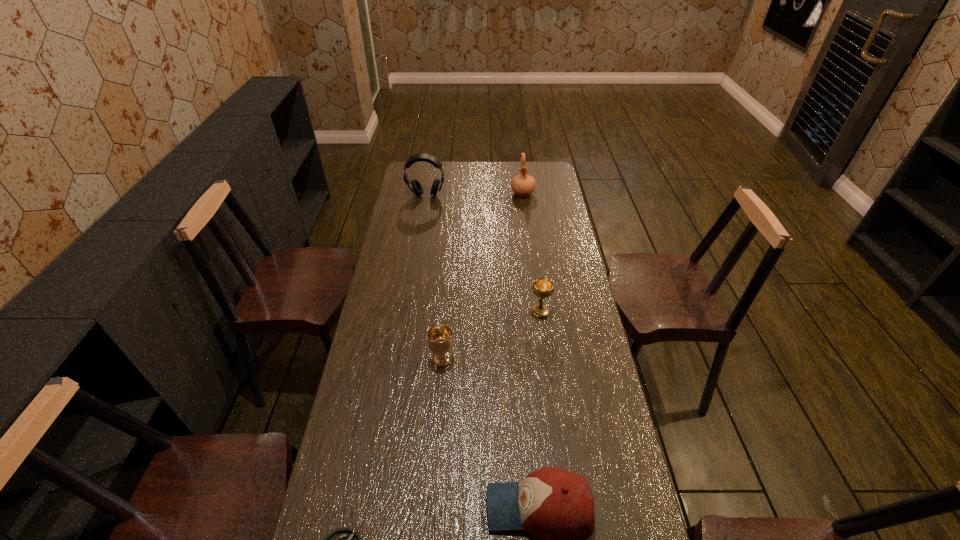
At what (x,y) coordinates should I click in order to perform the action: click on earphone. Please return your answer as a coordinate pair (x, y). This screenshot has height=540, width=960. Looking at the image, I should click on (414, 185).

This screenshot has height=540, width=960. In order to click on pottery in this screenshot , I will do point(523,185).

I want to click on the third farthest object, so click(x=542, y=287).

This screenshot has height=540, width=960. In order to click on the right chalice in this screenshot , I will do `click(542, 287)`.

Locate an element on the screen. the fourth object from right to left is located at coordinates (440, 340).

Find the location of a particular element. The height and width of the screenshot is (540, 960). the nearer chalice is located at coordinates (440, 340).

At what (x,y) coordinates should I click in order to perform the action: click on vacant space located on the ear cups of the earphone. Please return your answer as a coordinate pair (x, y). The width and height of the screenshot is (960, 540). Looking at the image, I should click on (420, 228).

At what (x,y) coordinates should I click in order to perform the action: click on vacant region located on the spout of the pottery. Please return your answer as a coordinate pair (x, y). The height and width of the screenshot is (540, 960). Looking at the image, I should click on (526, 216).

The width and height of the screenshot is (960, 540). I want to click on free space located on the right of the third farthest object, so click(x=582, y=312).

Find the location of a particular element. This screenshot has width=960, height=540. vacant space located 0.150m on the right of the fourth farthest object is located at coordinates (501, 359).